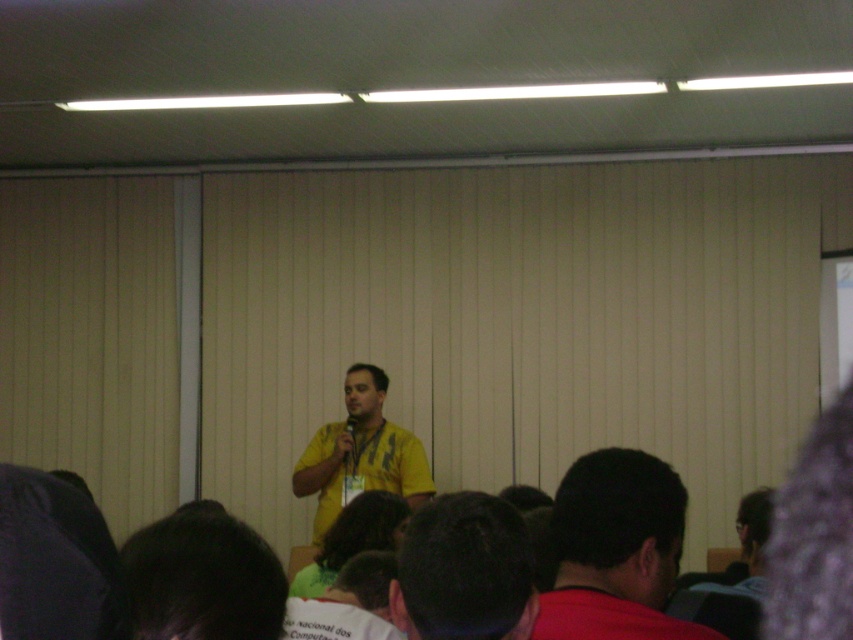
Based on the photo, you are organizing a photo shoot and need to ensure that the yellow shirt at center and the yellow fabric shirt at center are both visible in the frame. Given their size difference, which one might require more careful positioning to avoid being overshadowed?

The yellow shirt at center has a smaller size compared to yellow fabric shirt at center, so it might require more careful positioning to avoid being overshadowed.

You are sitting in the audience and want to know which of the two points, point (582, 602) or point (434, 577), is closer to you. Based on the scene description, which point is nearer?

Point (582, 602) is further to the viewer than point (434, 577). Therefore, point (434, 577) is closer to you.